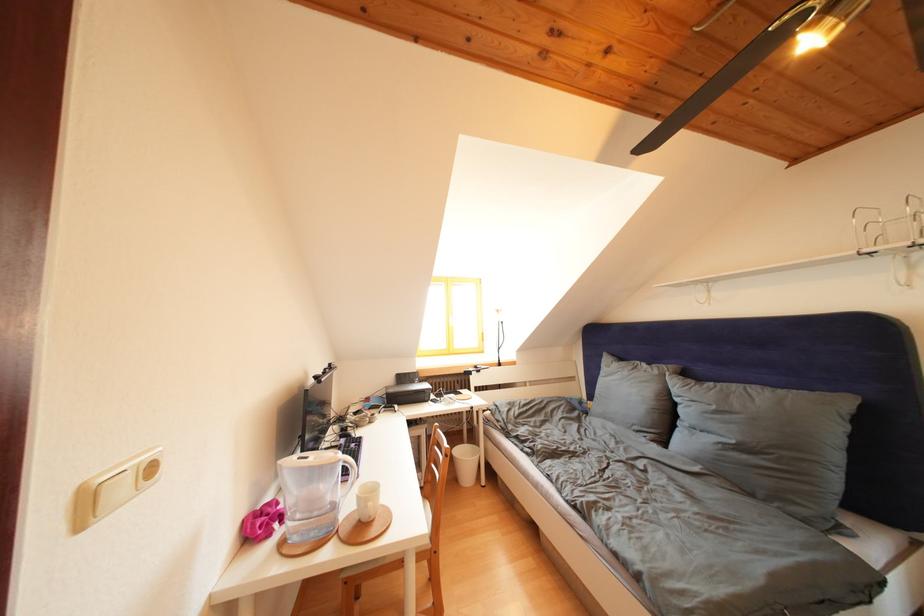
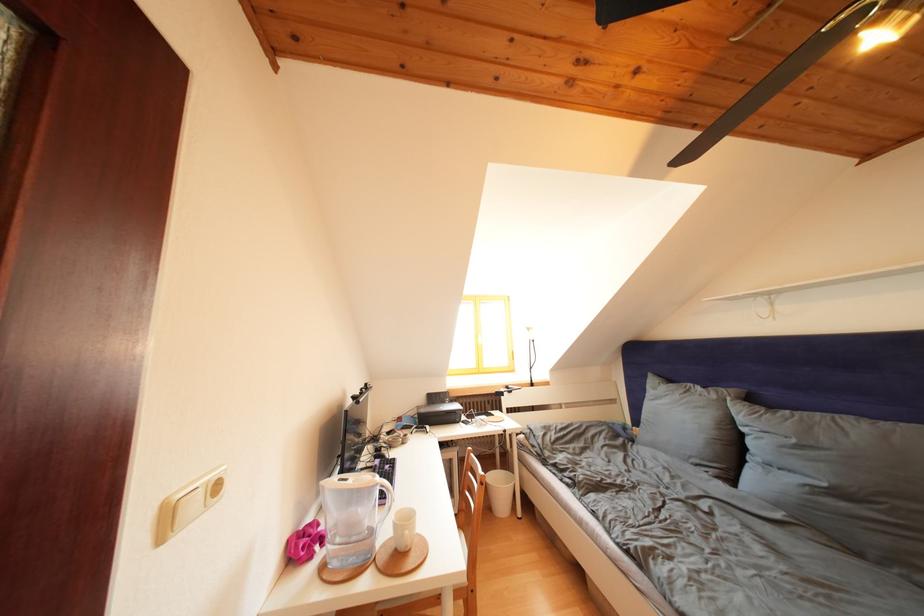
In the second image, find the point that corresponds to (433,431) in the first image.

(466, 454)